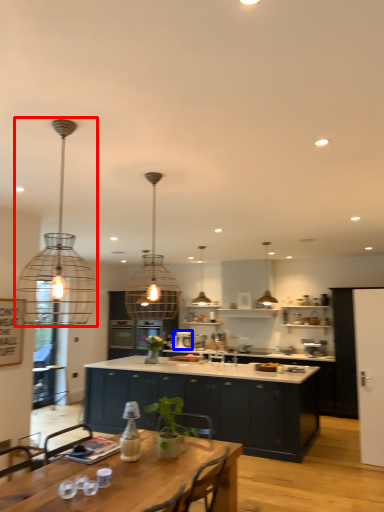
Question: Among these objects, which one is farthest to the camera, lamp (highlighted by a red box) or appliance (highlighted by a blue box)?

Choices:
 (A) lamp
 (B) appliance

Answer: (B)